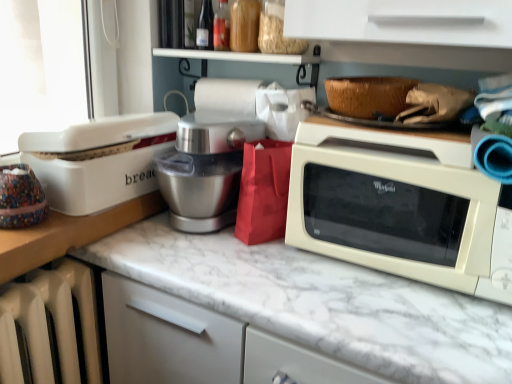
This screenshot has height=384, width=512. I want to click on free point above white marble countertop at center (from a real-world perspective), so click(x=315, y=278).